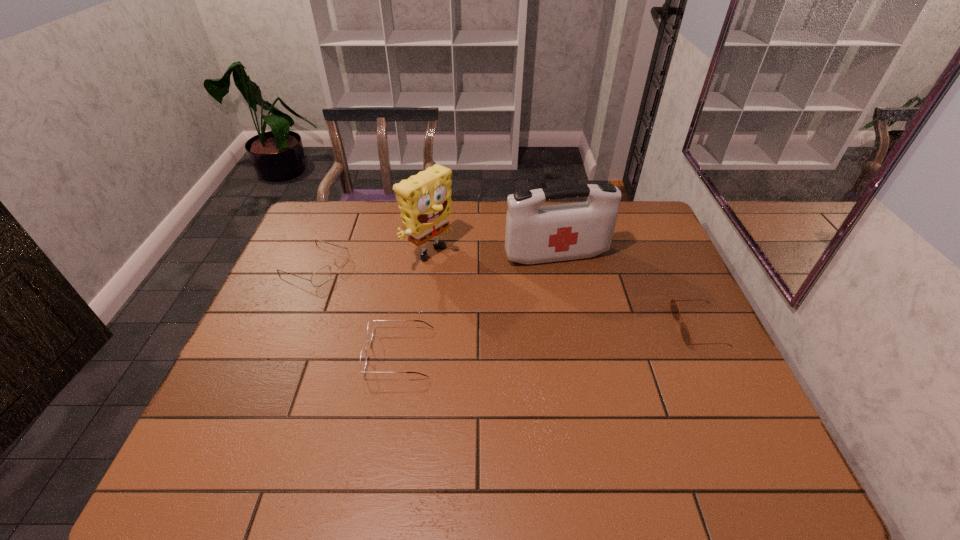
The height and width of the screenshot is (540, 960). I want to click on vacant area situated 0.050m on the face of the sunglasses, so click(x=660, y=327).

Find the location of a particular element. This screenshot has height=540, width=960. vacant space located on the face of the sunglasses is located at coordinates (656, 327).

The height and width of the screenshot is (540, 960). I want to click on free space located 0.330m on the face of the sunglasses, so click(557, 327).

Where is `vacant space located 0.220m on the face of the sponge`? vacant space located 0.220m on the face of the sponge is located at coordinates (500, 306).

You are a GUI agent. You are given a task and a screenshot of the screen. Output one action in this format:
    pyautogui.click(x=<x>, y=<y>)
    Task: Click on the vacant space situated 0.140m on the face of the sponge
    
    Given the screenshot: What is the action you would take?
    pyautogui.click(x=480, y=292)

You are a GUI agent. You are given a task and a screenshot of the screen. Output one action in this format:
    pyautogui.click(x=<x>, y=<y>)
    Task: Click on the free location located 0.070m on the face of the sponge
    The width and height of the screenshot is (960, 540).
    Given the screenshot: What is the action you would take?
    pyautogui.click(x=463, y=281)

At what (x,y) coordinates should I click in order to perform the action: click on vacant space located 0.390m on the front side of the fourth object from left to right. Please return your answer as a coordinate pair (x, y). Looking at the image, I should click on (614, 369).

What are the coordinates of `free space located 0.090m on the front side of the fourth object from left to right` in the screenshot? It's located at (576, 287).

Locate an element on the screen. The image size is (960, 540). free space located 0.120m on the front side of the fourth object from left to right is located at coordinates (580, 294).

In order to click on vacant space situated on the front-facing side of the leftmost object in this screenshot , I will do `click(429, 310)`.